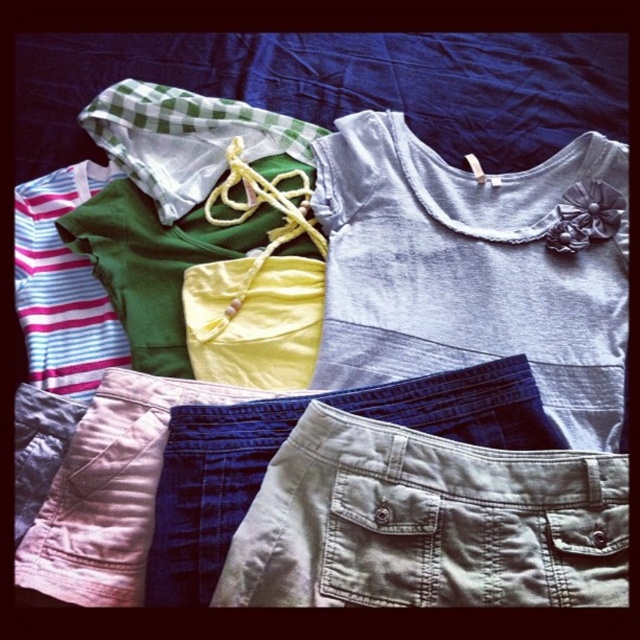
You are a parent trying to organize your child clothes. You have a gray cotton shirt at upper right and khaki cotton shorts at lower center. Do you think you can place them side by side on a shelf that is 25 centimeters wide?

The gray cotton shirt at upper right and khaki cotton shorts at lower center are 22.00 centimeters apart. Since the shelf is 25 centimeters wide, there is enough space to place them side by side.

You are looking at the image of children clothing items arranged on a dark blue fabric background. There is a point marked at coordinates (476, 268). Which clothing item is this point located on?

The point at coordinates (476, 268) is located on the gray cotton shirt at upper right.